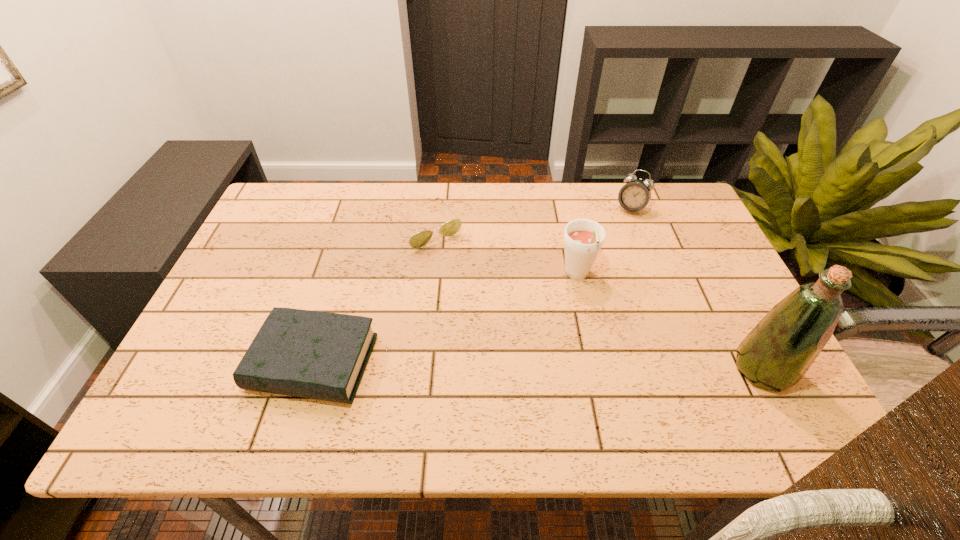
The height and width of the screenshot is (540, 960). I want to click on free spot between the Bible and the root beer, so click(445, 320).

At what (x,y) coordinates should I click in order to perform the action: click on empty space between the sunglasses and the third shortest object. Please return your answer as a coordinate pair (x, y). Image resolution: width=960 pixels, height=540 pixels. Looking at the image, I should click on (527, 218).

The image size is (960, 540). In order to click on the fourth closest object to the Bible in this screenshot , I will do (776, 354).

The height and width of the screenshot is (540, 960). Identify the location of the second closest object to the tallest object. pos(634,196).

Find the location of a particular element. vacant area in the image that satisfies the following two spatial constraints: 1. on the front side of the rightmost object; 2. on the front-facing side of the shortest object is located at coordinates (404, 369).

Find the location of a particular element. The height and width of the screenshot is (540, 960). free point that satisfies the following two spatial constraints: 1. on the front side of the shortest object; 2. on the front-facing side of the tallest object is located at coordinates (404, 369).